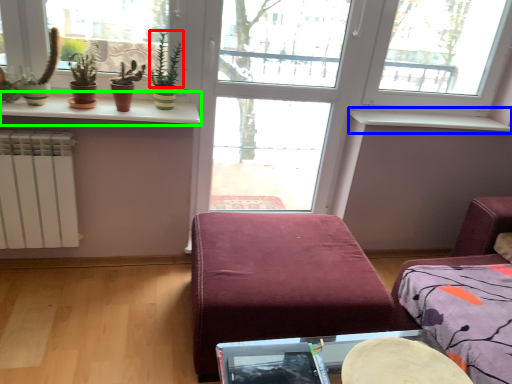
Question: Estimate the real-world distances between objects in this image. Which object is farther from plant (highlighted by a red box), window sill (highlighted by a blue box) or window sill (highlighted by a green box)?

Choices:
 (A) window sill
 (B) window sill

Answer: (A)